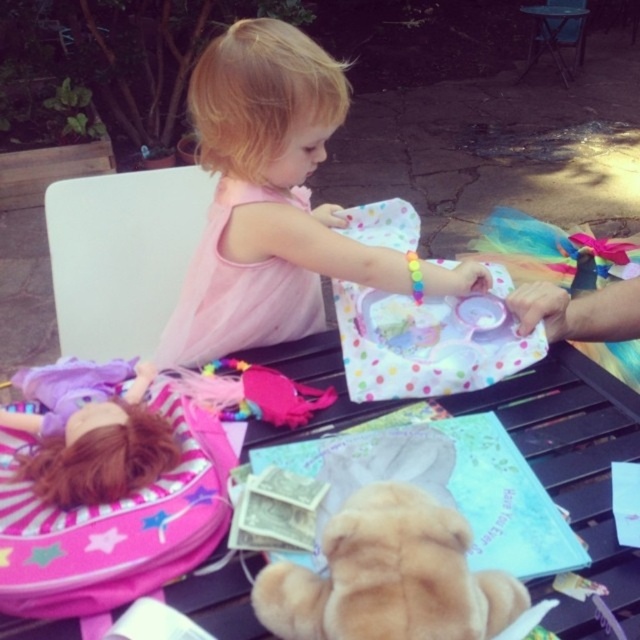
Is black plastic table at center taller than fuzzy beige teddy bear at lower center?

Yes.

Between black plastic table at center and fuzzy beige teddy bear at lower center, which one has more height?

black plastic table at center

Locate an element on the screen. The width and height of the screenshot is (640, 640). black plastic table at center is located at coordinates (573, 452).

Where is `black plastic table at center`? This screenshot has width=640, height=640. black plastic table at center is located at coordinates (573, 452).

Is point (310, 83) more distant than point (262, 570)?

Yes, it is.

Who is more forward, (243,188) or (314,593)?

Point (314,593) is in front.

Image resolution: width=640 pixels, height=640 pixels. I want to click on pink fabric dress at center, so click(x=266, y=196).

In the scene shown: Can you confirm if pink fabric dress at center is wider than black plastic table at center?

No, pink fabric dress at center is not wider than black plastic table at center.

Between point (252, 161) and point (216, 628), which one is positioned behind?

The point (252, 161) is behind.

Is point (356, 250) more distant than point (320, 356)?

Yes, point (356, 250) is farther from viewer.

The width and height of the screenshot is (640, 640). What are the coordinates of `pink fabric dress at center` in the screenshot? It's located at (266, 196).